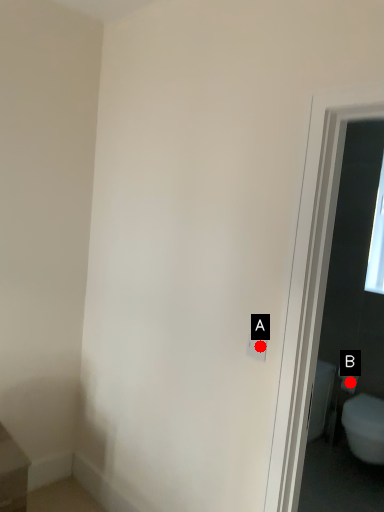
Question: Two points are circled on the image, labeled by A and B beside each circle. Which point is closer to the camera?

Choices:
 (A) A is closer
 (B) B is closer

Answer: (A)